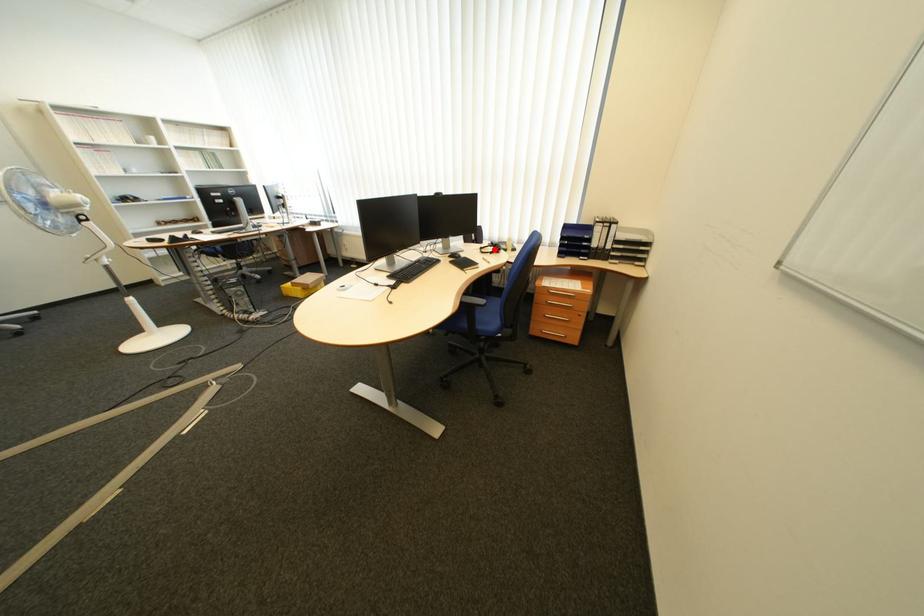
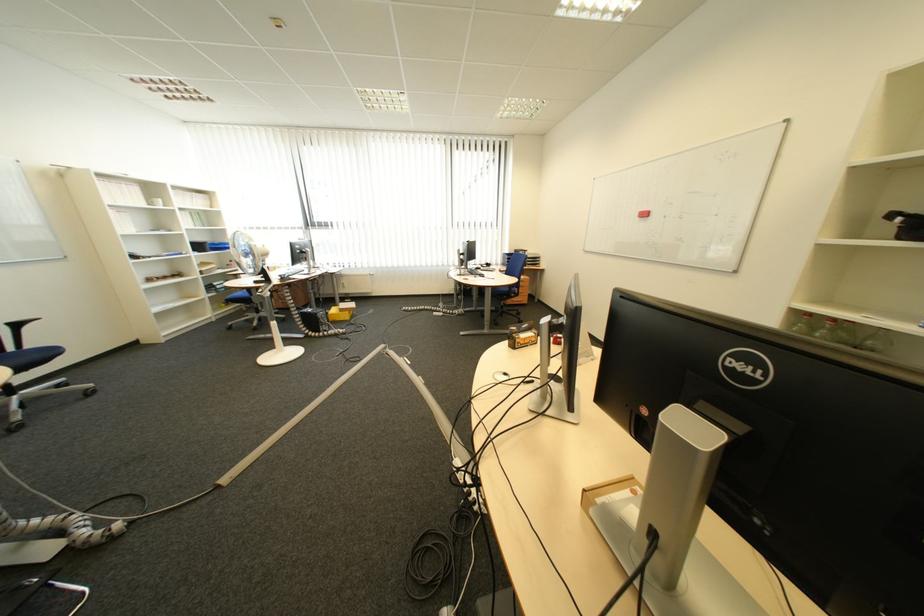
Question: I am providing you with two images of the same scene from different viewpoints. A red point is marked on the first image. Is the red point's position out of view in image 2?

Choices:
 (A) Yes
 (B) No

Answer: (A)